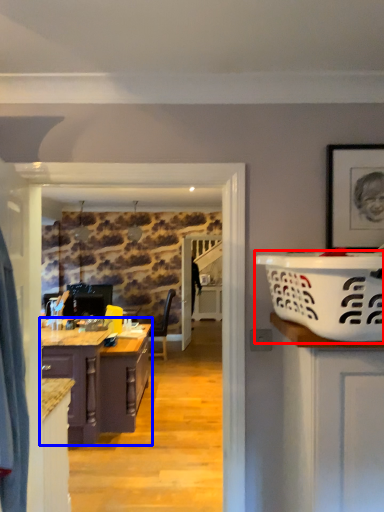
Question: Among these objects, which one is nearest to the camera, basket (highlighted by a red box) or cabinetry (highlighted by a blue box)?

Choices:
 (A) basket
 (B) cabinetry

Answer: (A)